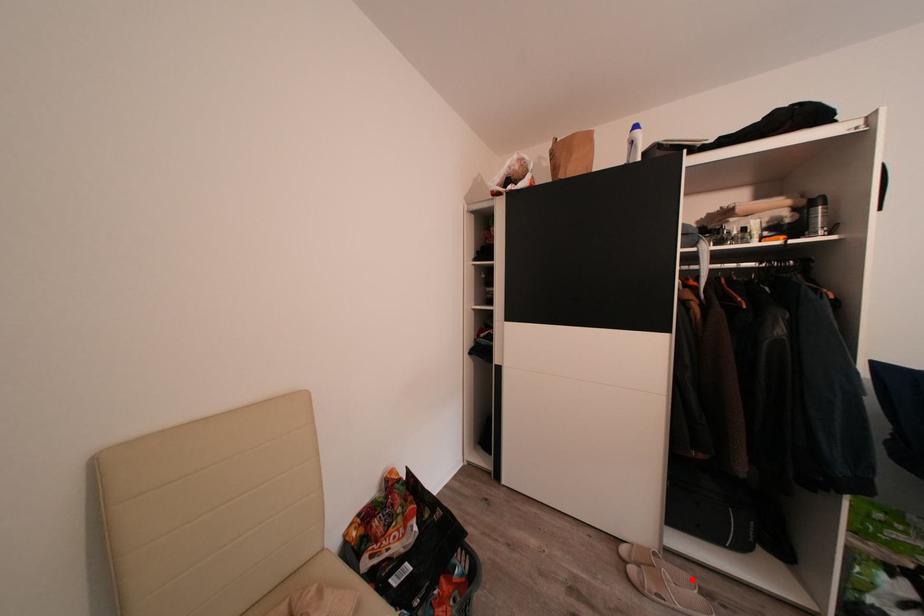
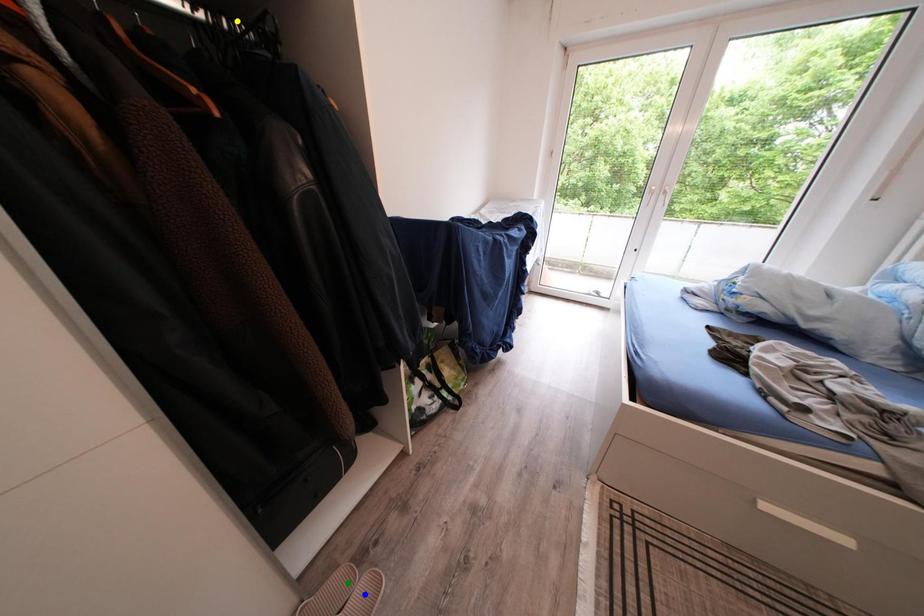
Question: I am providing you with two images of the same scene from different viewpoints. A red point is marked on the first image. You are given multiple points on the second image. Which point in image 2 is actually the same real-world point as the red point in image 1?

Choices:
 (A) yellow point
 (B) green point
 (C) blue point

Answer: (B)